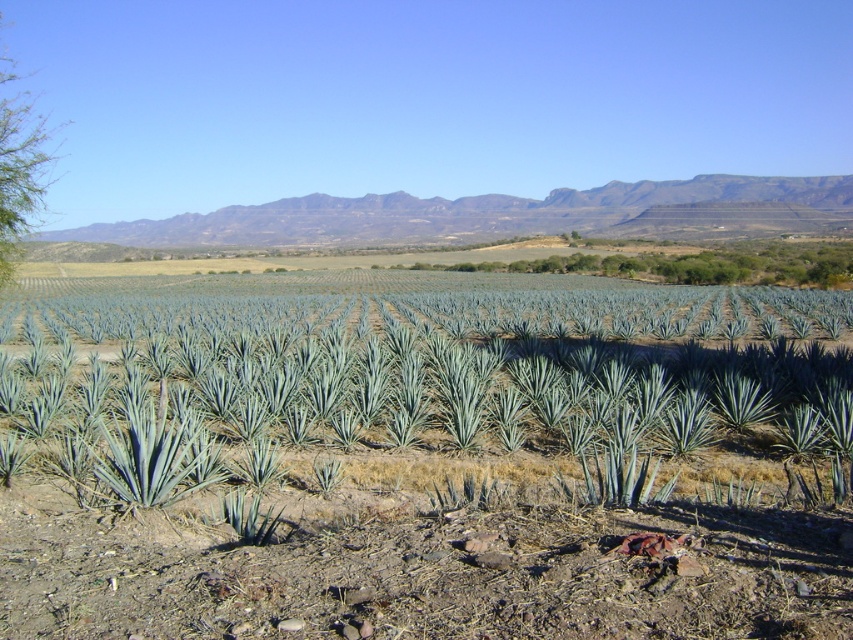
Who is more forward, (616, 236) or (805, 256)?

Point (805, 256)

Is rugged brown mountains at upper center above green leafy tree at center?

Indeed, rugged brown mountains at upper center is positioned over green leafy tree at center.

Between point (115, 225) and point (733, 244), which one is positioned in front?

Point (733, 244)

Find the location of a particular element. Image resolution: width=853 pixels, height=640 pixels. rugged brown mountains at upper center is located at coordinates (500, 214).

Does point (352, 204) come behind point (4, 140)?

Yes, it is.

Does rugged brown mountains at upper center have a smaller size compared to green leafy tree at left?

Correct, rugged brown mountains at upper center occupies less space than green leafy tree at left.

Locate an element on the screen. rugged brown mountains at upper center is located at coordinates (500, 214).

What are the coordinates of `rugged brown mountains at upper center` in the screenshot? It's located at (500, 214).

Does green leafy tree at center lie in front of green leafy tree at left?

No, green leafy tree at center is further to the viewer.

Between point (848, 280) and point (4, 156), which one is positioned behind?

Point (848, 280)

Which is in front, point (579, 253) or point (16, 177)?

Positioned in front is point (16, 177).

In order to click on green leafy tree at center in this screenshot , I will do `click(694, 264)`.